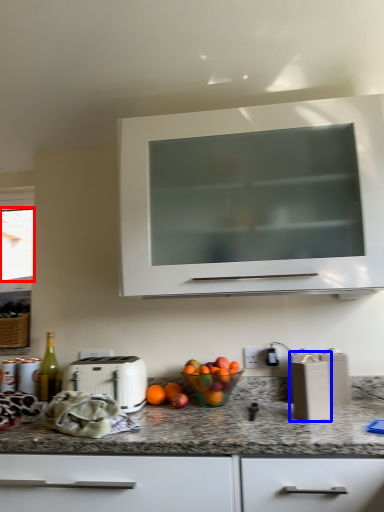
Question: Which of the following is the closest to the observer, window screen (highlighted by a red box) or appliance (highlighted by a blue box)?

Choices:
 (A) window screen
 (B) appliance

Answer: (B)